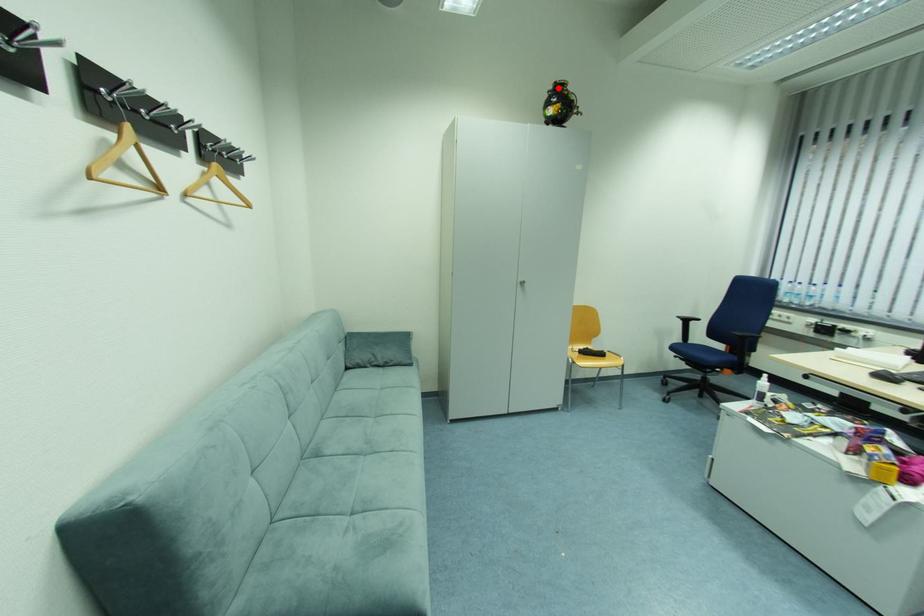
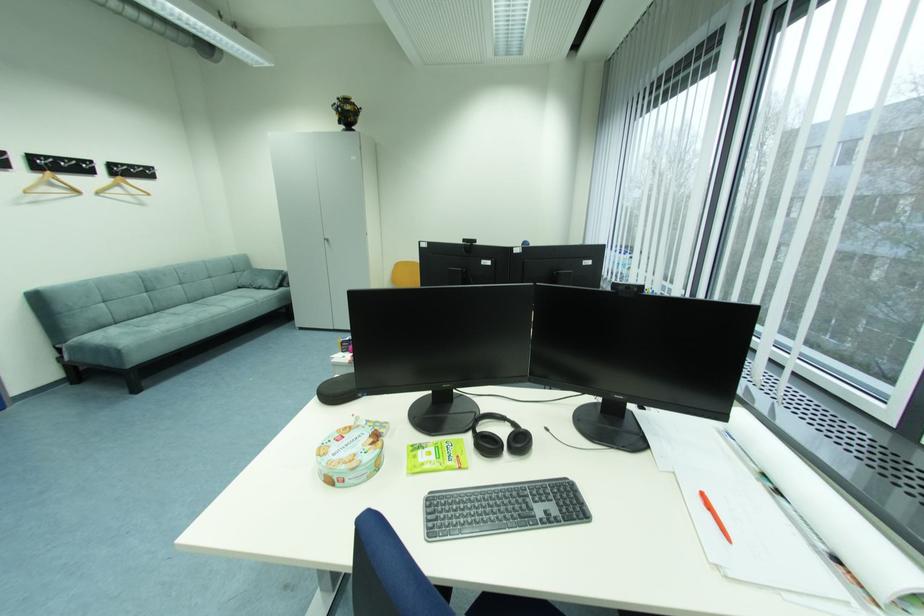
Where in the second image is the point corresponding to the highlighted location from the first image?

(344, 103)